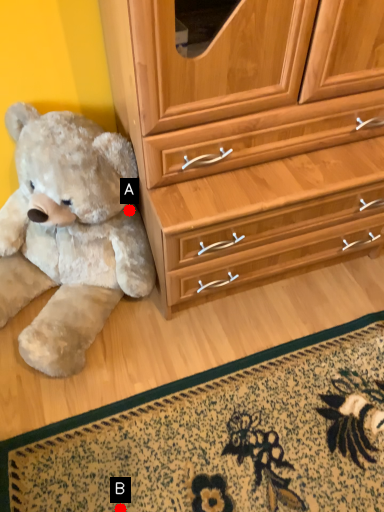
Question: Two points are circled on the image, labeled by A and B beside each circle. Which point appears farthest from the camera in this image?

Choices:
 (A) A is further
 (B) B is further

Answer: (A)